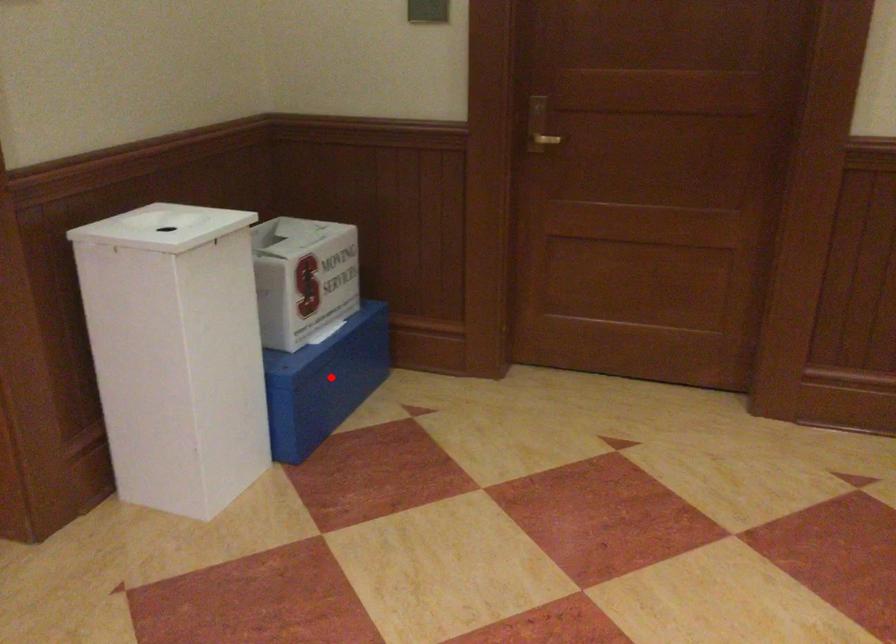
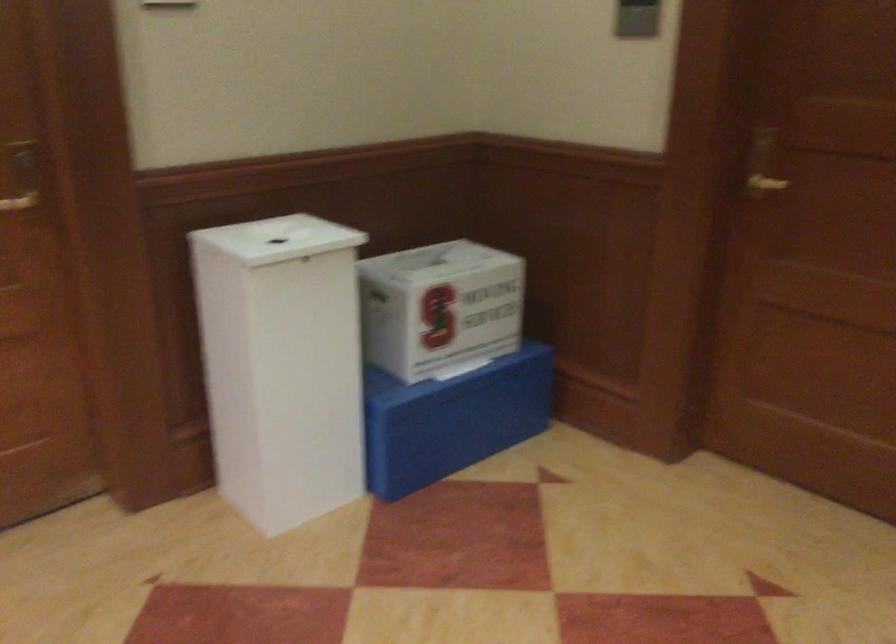
Find the pixel in the second image that matches the highlighted location in the first image.

(452, 419)